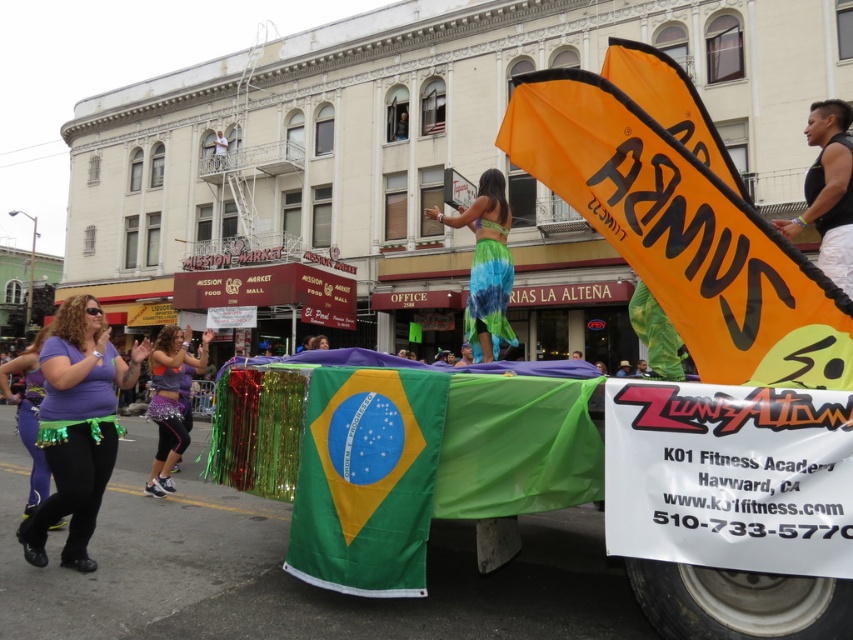
Question: Considering the real-world distances, which object is farthest from the purple fabric skirt at lower left?

Choices:
 (A) orange fabric flag at upper right
 (B) purple shiny leggings at lower left

Answer: (A)

Question: Estimate the real-world distances between objects in this image. Which object is closer to the green fabric flag at center?

Choices:
 (A) purple shiny leggings at lower left
 (B) blue tie-dye skirt at center

Answer: (B)

Question: Among these points, which one is farthest from the camera?

Choices:
 (A) (154, 380)
 (B) (45, 396)
 (C) (341, 426)
 (D) (30, 408)

Answer: (A)

Question: Is orange fabric flag at upper right below black tank top at upper right?

Choices:
 (A) no
 (B) yes

Answer: (B)

Question: Can you confirm if purple fabric skirt at lower left is positioned below blue tie-dye skirt at center?

Choices:
 (A) yes
 (B) no

Answer: (A)

Question: Does blue tie-dye skirt at center appear over purple shiny leggings at lower left?

Choices:
 (A) no
 (B) yes

Answer: (B)